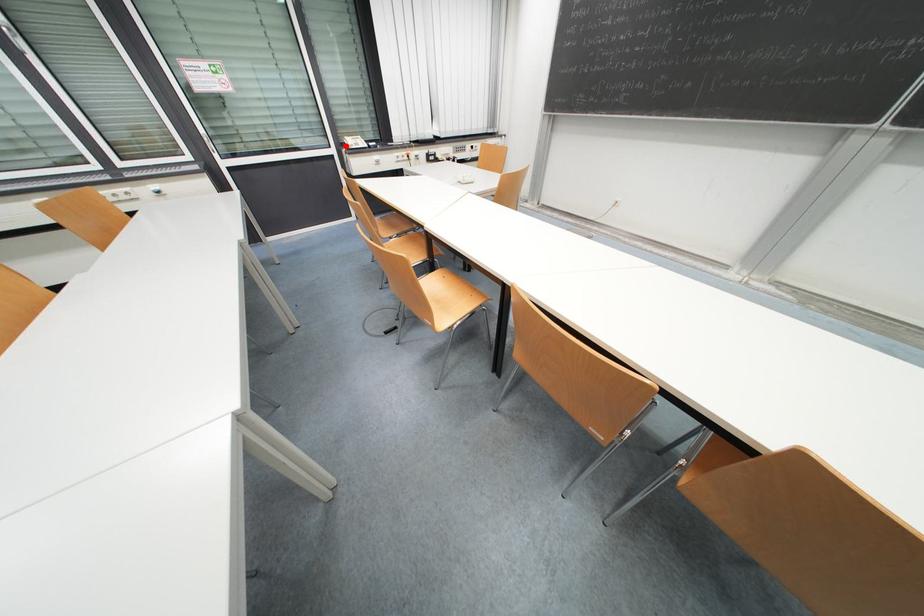
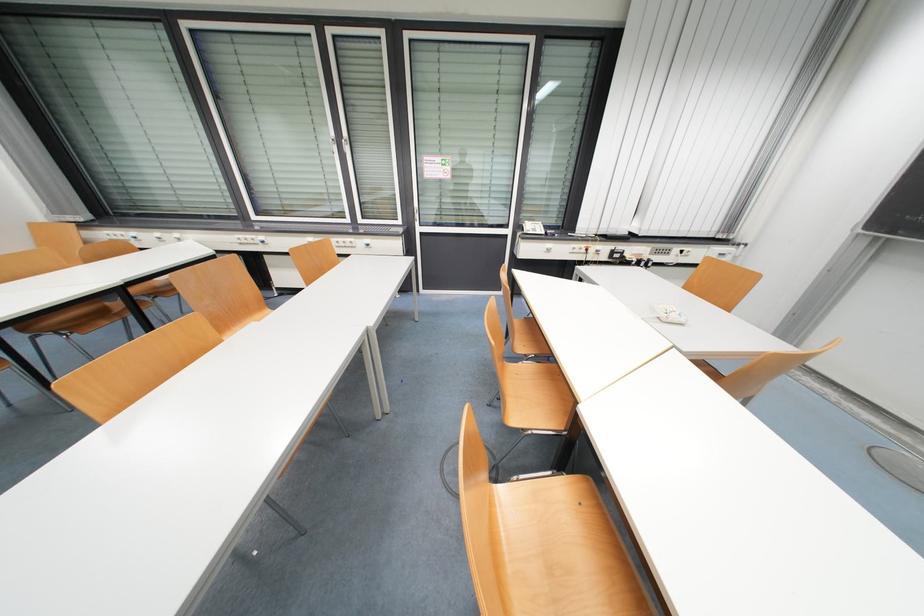
Find the pixel in the second image that matches the highlighted location in the first image.

(524, 229)